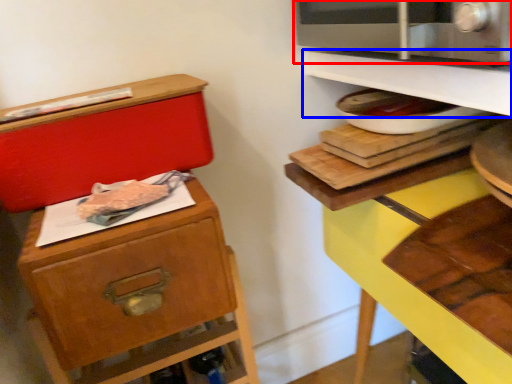
Question: Which of the following is the closest to the observer, microwave oven (highlighted by a red box) or shelf (highlighted by a blue box)?

Choices:
 (A) microwave oven
 (B) shelf

Answer: (A)